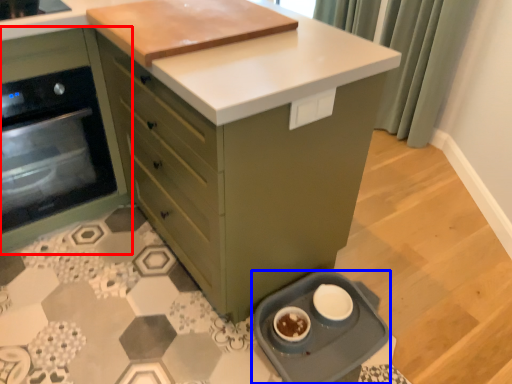
Question: Which point is closer to the camera, cabinetry (highlighted by a red box) or kitchen appliance (highlighted by a blue box)?

Choices:
 (A) cabinetry
 (B) kitchen appliance

Answer: (B)